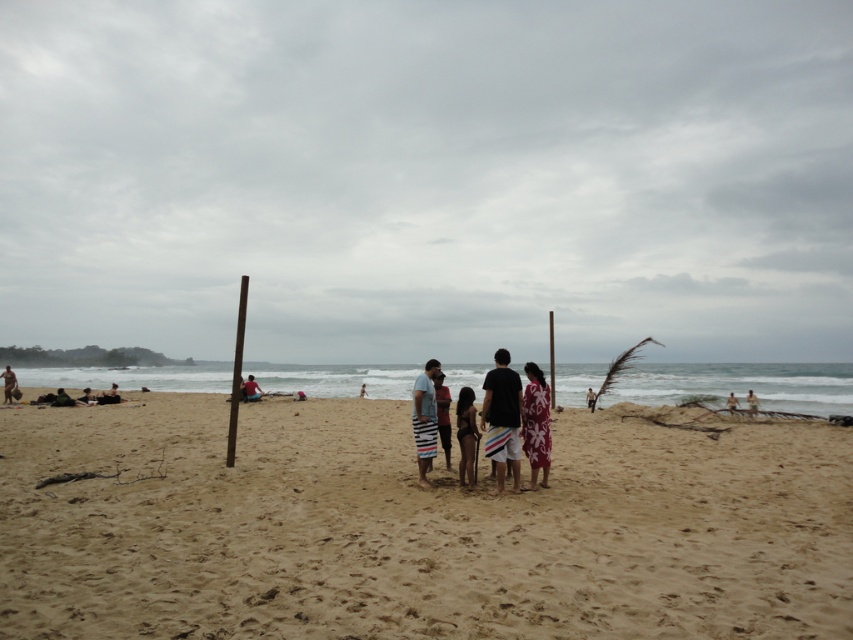
Based on the photo, who is more forward, (421, 440) or (358, 396)?

Point (421, 440)

Does point (427, 449) come in front of point (360, 385)?

Yes.

Find the location of a particular element. This screenshot has width=853, height=640. striped board shorts at center is located at coordinates (424, 419).

Is point (747, 406) closer to camera compared to point (587, 394)?

No.

Between light brown wooden pole at center and brown textured surfboard at center, which one appears on the right side from the viewer's perspective?

Positioned to the right is light brown wooden pole at center.

Between point (747, 403) and point (592, 403), which one is positioned in front?

Point (592, 403) is more forward.

At what (x,y) coordinates should I click in order to perform the action: click on light brown wooden pole at center. Please return your answer as a coordinate pair (x, y). This screenshot has height=640, width=853. Looking at the image, I should click on (751, 403).

Between striped cotton shorts at center and brown textured surfboard at center, which one is positioned lower?

brown textured surfboard at center is lower down.

Is striped cotton shorts at center above brown textured surfboard at center?

Yes.

Is point (502, 461) closer to viewer compared to point (589, 404)?

Yes, it is in front of point (589, 404).

The width and height of the screenshot is (853, 640). Find the location of `striped cotton shorts at center`. striped cotton shorts at center is located at coordinates (502, 417).